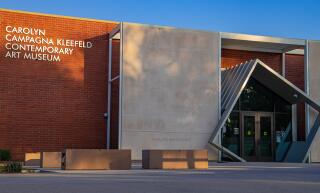
Where is `red brick wall`? red brick wall is located at coordinates tap(293, 68), tap(232, 58), tap(82, 58).